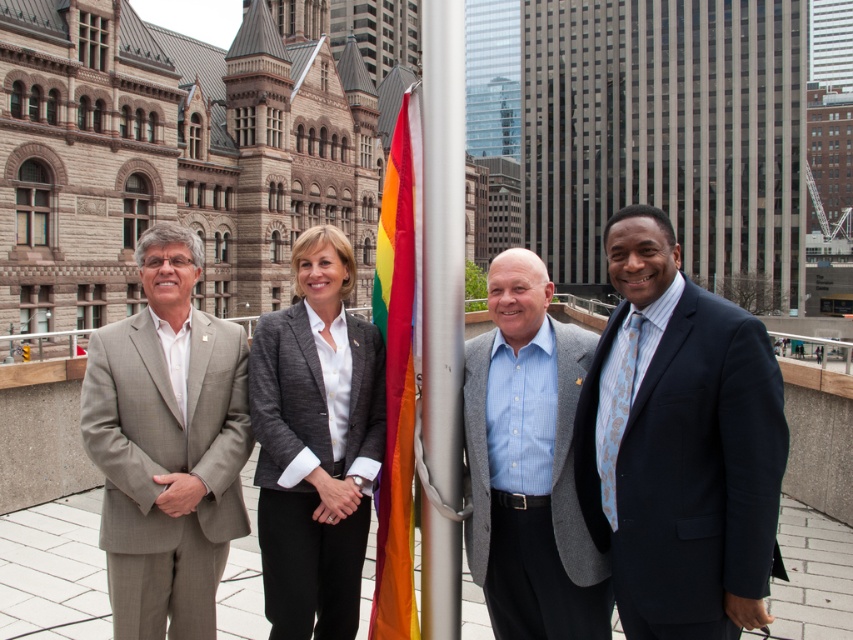
Question: Which point is farther to the camera?

Choices:
 (A) (x=453, y=246)
 (B) (x=381, y=346)
 (C) (x=405, y=600)
 (D) (x=654, y=528)

Answer: (B)

Question: Can you confirm if blue textured suit at right is positioned below rainbow fabric flag at center?

Choices:
 (A) yes
 (B) no

Answer: (A)

Question: Estimate the real-world distances between objects in this image. Which object is closer to the blue textured suit at right?

Choices:
 (A) rainbow fabric flag at center
 (B) light brown suit at left
 (C) brushed metal flag pole at center

Answer: (C)

Question: Which of these objects is positioned farthest from the gray wool suit at center?

Choices:
 (A) brushed metal flag pole at center
 (B) gray wool blazer at center

Answer: (B)

Question: Does light brown suit at left have a greater width compared to gray wool blazer at center?

Choices:
 (A) yes
 (B) no

Answer: (A)

Question: Does gray wool suit at center have a smaller size compared to rainbow fabric flag at center?

Choices:
 (A) yes
 (B) no

Answer: (B)